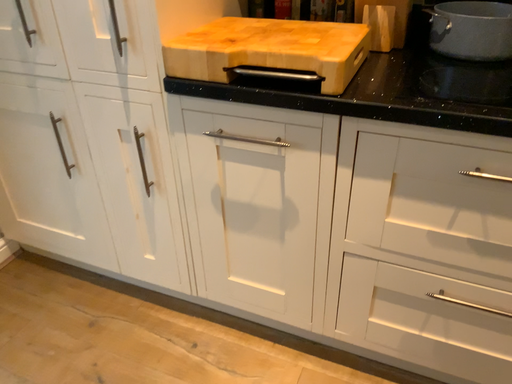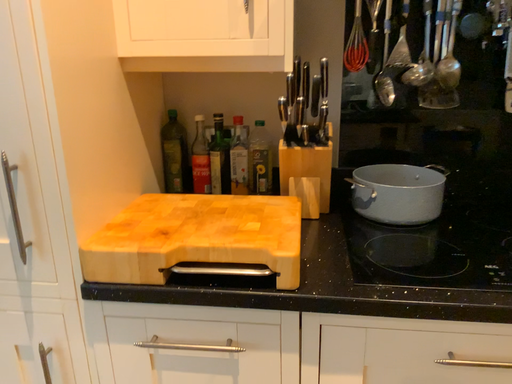
Question: How did the camera likely rotate when shooting the video?

Choices:
 (A) rotated right
 (B) rotated left

Answer: (A)